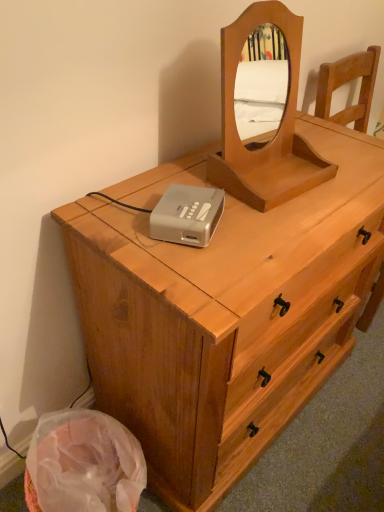
Identify the location of unoccupied region to the right of light brown wooden mirror at upper center. (342, 196).